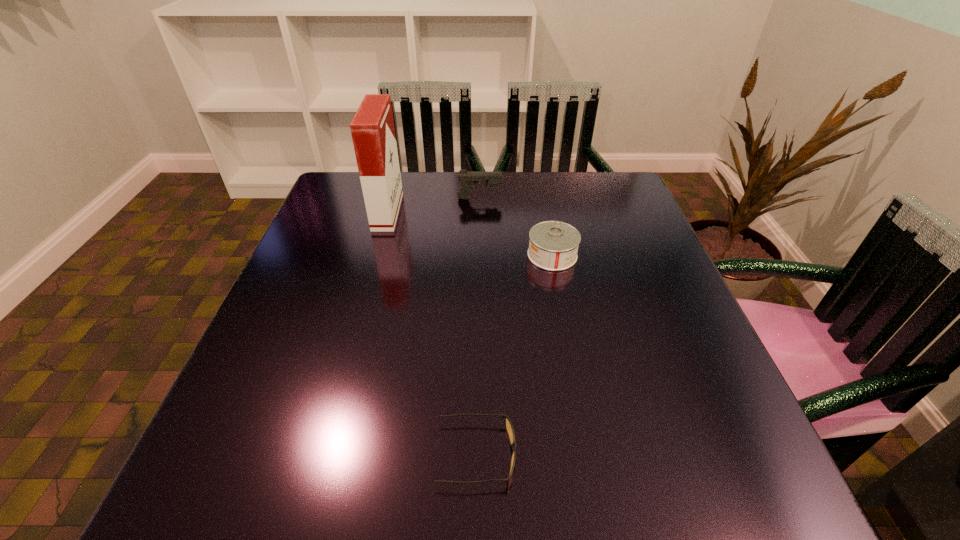
This screenshot has height=540, width=960. In order to click on blank space at the far left corner of the desktop in this screenshot , I will do `click(342, 209)`.

In the image, there is a desktop. At what (x,y) coordinates should I click in order to perform the action: click on blank space at the far right corner. Please return your answer as a coordinate pair (x, y). Looking at the image, I should click on (577, 186).

Locate an element on the screen. This screenshot has height=540, width=960. unoccupied area between the pistol and the rightmost object is located at coordinates (516, 227).

Where is `free spot between the third tallest object and the third shortest object`? The image size is (960, 540). free spot between the third tallest object and the third shortest object is located at coordinates (516, 227).

Find the location of a particular element. empty space between the pistol and the cigarette_case is located at coordinates (434, 205).

Image resolution: width=960 pixels, height=540 pixels. Find the location of `free space between the sunglasses and the second nearest object`. free space between the sunglasses and the second nearest object is located at coordinates 515,354.

Where is `free point between the shortest object and the second nearest object`? This screenshot has height=540, width=960. free point between the shortest object and the second nearest object is located at coordinates (515, 354).

Locate an element on the screen. The image size is (960, 540). vacant area between the second tallest object and the shortest object is located at coordinates (478, 326).

This screenshot has height=540, width=960. I want to click on free space between the cigarette_case and the sunglasses, so click(x=432, y=333).

Locate an element on the screen. The height and width of the screenshot is (540, 960). vacant space in between the third tallest object and the tallest object is located at coordinates (470, 233).